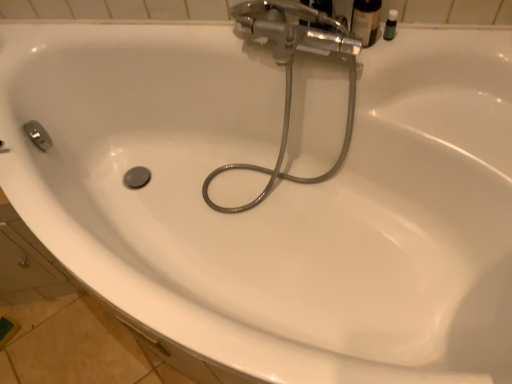
Question: Which is correct: matte black bottle at upper right, the first toiletry from the left, is inside metallic hose at center, or outside of it?

Choices:
 (A) outside
 (B) inside

Answer: (A)

Question: In terms of size, does matte black bottle at upper right, the second toiletry from the right, appear bigger or smaller than metallic hose at center?

Choices:
 (A) big
 (B) small

Answer: (B)

Question: Considering the real-world distances, which object is closest to the green matte bottle at upper right, the second toiletry when ordered from left to right?

Choices:
 (A) metallic hose at center
 (B) matte black bottle at upper right, the second toiletry from the right

Answer: (B)

Question: Considering the real-world distances, which object is farthest from the metallic hose at center?

Choices:
 (A) green matte bottle at upper right, which appears as the 1th toiletry when viewed from the right
 (B) matte black bottle at upper right, the second toiletry from the right

Answer: (A)